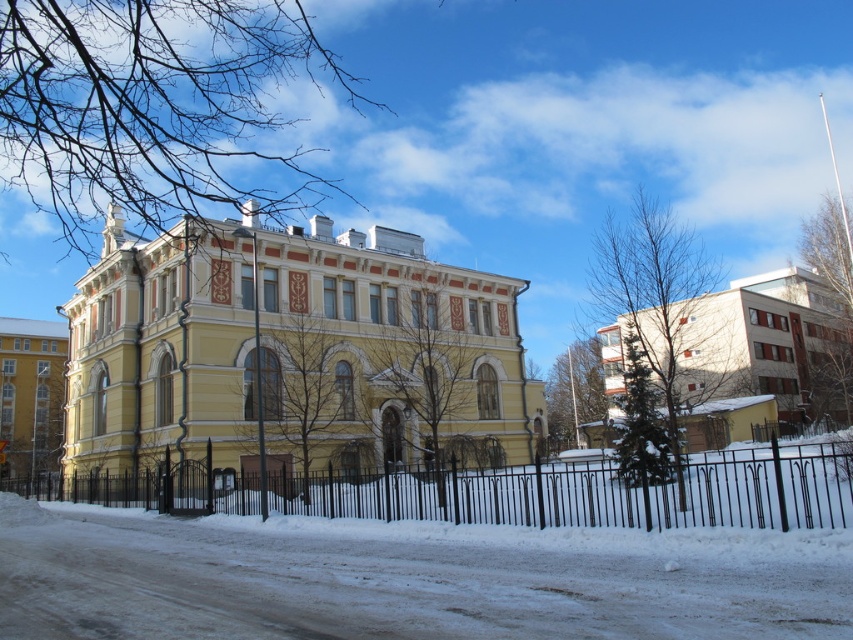
Question: Can you confirm if yellow matte building at center is wider than black wrought iron fence at lower center?

Choices:
 (A) no
 (B) yes

Answer: (A)

Question: Among these objects, which one is nearest to the camera?

Choices:
 (A) white matte building at right
 (B) yellow matte building at center

Answer: (A)

Question: Considering the real-world distances, which object is closest to the black wrought iron fence at lower center?

Choices:
 (A) white matte building at right
 (B) yellow matte building at center
 (C) yellow stone building at left

Answer: (B)

Question: Is yellow matte building at center further to the viewer compared to white matte building at right?

Choices:
 (A) yes
 (B) no

Answer: (A)

Question: From the image, what is the correct spatial relationship of black wrought iron fence at lower center in relation to yellow stone building at left?

Choices:
 (A) above
 (B) below

Answer: (A)

Question: Among these points, which one is farthest from the camera?

Choices:
 (A) (392, 333)
 (B) (761, 344)
 (C) (56, 445)
 (D) (357, 515)

Answer: (C)